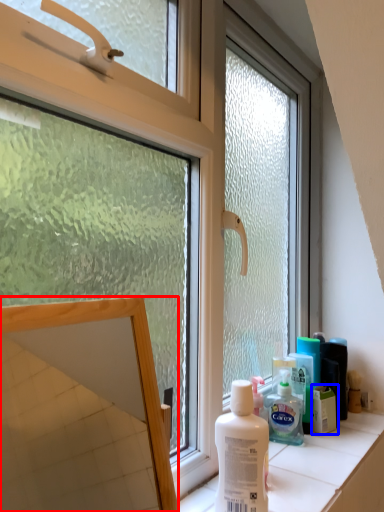
Question: Which of the following is the farthest to the observer, mirror (highlighted by a red box) or product (highlighted by a blue box)?

Choices:
 (A) mirror
 (B) product

Answer: (B)